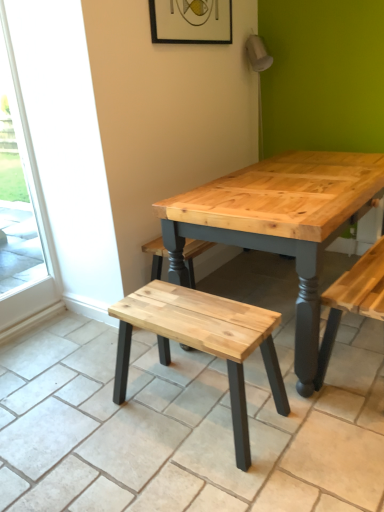
The image size is (384, 512). What do you see at coordinates (32, 209) in the screenshot?
I see `transparent glass screen door at left` at bounding box center [32, 209].

Locate an element on the screen. wooden frame at upper center is located at coordinates (x=191, y=21).

Is wooden frame at upper center turned away from natural wood stool at center?

No, wooden frame at upper center's orientation is not away from natural wood stool at center.

From the image's perspective, is wooden frame at upper center under natural wood stool at center?

No.

Is wooden frame at upper center located outside natural wood stool at center?

Absolutely, wooden frame at upper center is external to natural wood stool at center.

From a real-world perspective, is wooden frame at upper center located beneath natural wood stool at center?

Incorrect, from a real-world perspective, wooden frame at upper center is higher than natural wood stool at center.

From a real-world perspective, which is physically above, natural wood stool at center or transparent glass screen door at left?

transparent glass screen door at left, from a real-world perspective.

Is natural wood stool at center to the right of transparent glass screen door at left from the viewer's perspective?

Yes.

Is natural wood stool at center shorter than transparent glass screen door at left?

Yes.

Is natural wood stool at center inside the boundaries of transparent glass screen door at left, or outside?

natural wood stool at center is not enclosed by transparent glass screen door at left.

Considering the relative positions of natural wood stool at center and wooden frame at upper center in the image provided, is natural wood stool at center to the right of wooden frame at upper center from the viewer's perspective?

No, natural wood stool at center is not to the right of wooden frame at upper center.

This screenshot has height=512, width=384. I want to click on stool below the wooden frame at upper center (from the image's perspective), so pyautogui.click(x=203, y=342).

Which object is further away from the camera taking this photo, natural wood stool at center or wooden frame at upper center?

wooden frame at upper center is further away from the camera.

Is natural wood stool at center positioned beyond the bounds of wooden frame at upper center?

Yes, natural wood stool at center is not within wooden frame at upper center.

From the image's perspective, which one is positioned lower, wooden frame at upper center or transparent glass screen door at left?

transparent glass screen door at left, from the image's perspective.

Is wooden frame at upper center at the left side of transparent glass screen door at left?

No, wooden frame at upper center is not to the left of transparent glass screen door at left.

Is wooden frame at upper center behind transparent glass screen door at left?

Yes, wooden frame at upper center is further from the viewer.

From the image's perspective, which one is positioned lower, transparent glass screen door at left or natural wood stool at center?

From the image's view, natural wood stool at center is below.

Identify the location of stool directly beneath the transparent glass screen door at left (from a real-world perspective). Image resolution: width=384 pixels, height=512 pixels. (203, 342).

Based on the photo, is transparent glass screen door at left oriented away from natural wood stool at center?

transparent glass screen door at left does not have its back to natural wood stool at center.

From the image's perspective, between transparent glass screen door at left and wooden frame at upper center, which one is located above?

wooden frame at upper center, from the image's perspective.

From a real-world perspective, relative to wooden frame at upper center, is transparent glass screen door at left vertically above or below?

In terms of real-world spatial position, transparent glass screen door at left is below wooden frame at upper center.

Who is smaller, transparent glass screen door at left or wooden frame at upper center?

With smaller size is wooden frame at upper center.

The image size is (384, 512). Find the location of `picture frame above the natural wood stool at center (from a real-world perspective)`. picture frame above the natural wood stool at center (from a real-world perspective) is located at coordinates (191, 21).

Identify the location of stool below the transparent glass screen door at left (from a real-world perspective). Image resolution: width=384 pixels, height=512 pixels. (203, 342).

Based on the photo, when comparing their distances from natural wood stool at center, does transparent glass screen door at left or wooden frame at upper center seem closer?

Among the two, transparent glass screen door at left is located nearer to natural wood stool at center.

From the image, which object appears to be farther from natural wood stool at center, wooden frame at upper center or transparent glass screen door at left?

wooden frame at upper center is positioned further to the anchor natural wood stool at center.

Looking at the image, which one is located closer to wooden frame at upper center, transparent glass screen door at left or natural wood stool at center?

transparent glass screen door at left is positioned closer to the anchor wooden frame at upper center.

Estimate the real-world distances between objects in this image. Which object is further from transparent glass screen door at left, natural wood stool at center or wooden frame at upper center?

Among the two, natural wood stool at center is located further to transparent glass screen door at left.

Considering their positions, is wooden frame at upper center positioned further to transparent glass screen door at left than natural wood stool at center?

natural wood stool at center.

Estimate the real-world distances between objects in this image. Which object is closer to wooden frame at upper center, natural wood stool at center or transparent glass screen door at left?

The object closer to wooden frame at upper center is transparent glass screen door at left.

What are the coordinates of `screen door that lies between wooden frame at upper center and natural wood stool at center from top to bottom` in the screenshot? It's located at (32, 209).